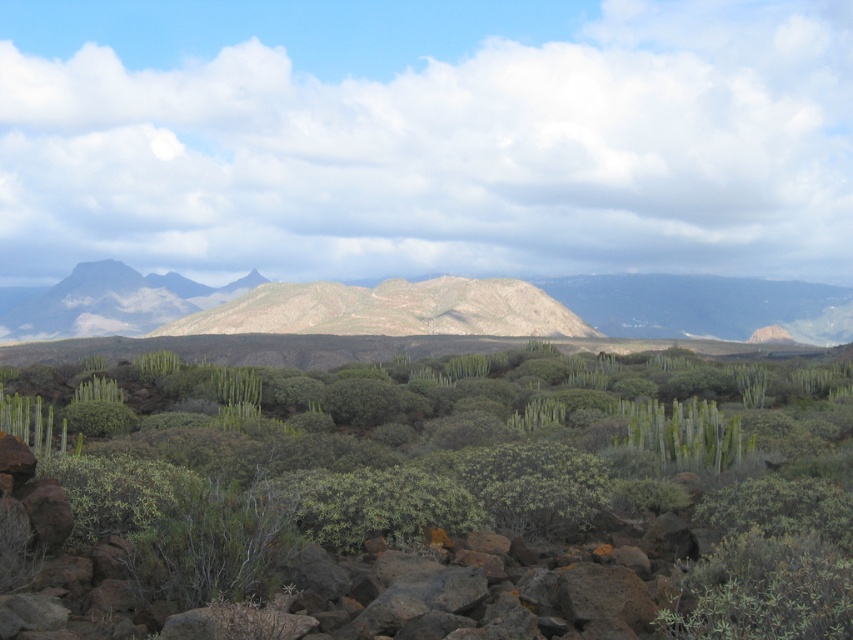
Who is positioned more to the left, brown/dry soil at center or green spiky cactus at center?

brown/dry soil at center

Locate an element on the screen. The width and height of the screenshot is (853, 640). brown/dry soil at center is located at coordinates (704, 305).

Identify the location of brown/dry soil at center. (704, 305).